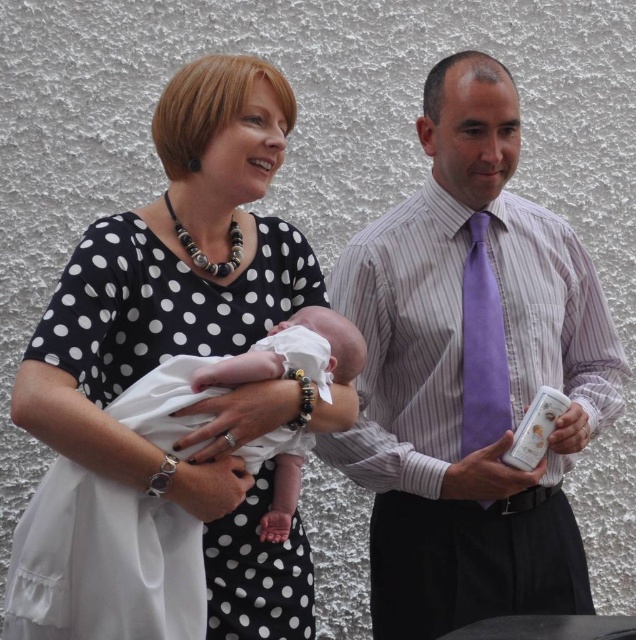
Question: Which of these objects is positioned farthest from the white polka dot dress at center?

Choices:
 (A) purple suede tie at right
 (B) white soft cloth at center
 (C) purple striped shirt at center

Answer: (A)

Question: Is white polka dot dress at center below white soft cloth at center?

Choices:
 (A) yes
 (B) no

Answer: (B)

Question: Which of the following is the closest to the observer?

Choices:
 (A) (249, 374)
 (B) (469, 412)

Answer: (A)

Question: Which point is farther to the camera?

Choices:
 (A) (462, 342)
 (B) (347, 337)
 (C) (258, 598)

Answer: (A)

Question: Does white polka dot dress at center appear under purple suede tie at right?

Choices:
 (A) yes
 (B) no

Answer: (B)

Question: Where is purple striped shirt at center located in relation to white polka dot dress at center in the image?

Choices:
 (A) above
 (B) below

Answer: (B)